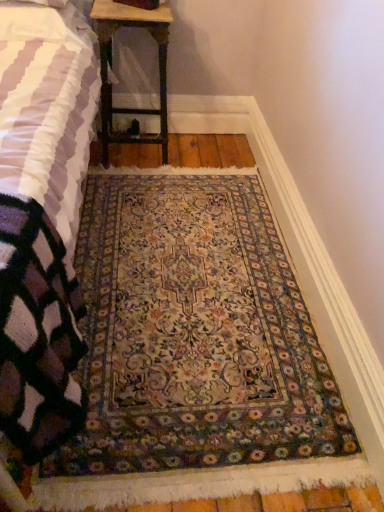
I want to click on free space in front of wooden table at upper center, so click(x=142, y=179).